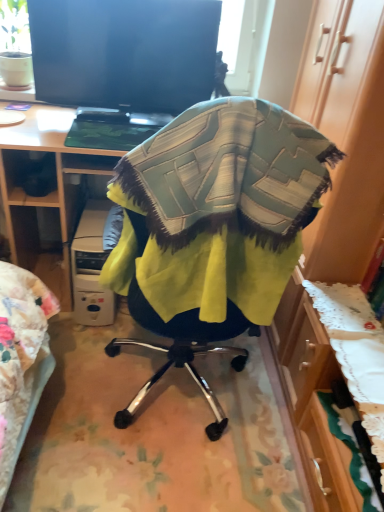
Question: Should I look upward or downward to see textured fabric chair at center?

Choices:
 (A) up
 (B) down

Answer: (A)

Question: Is black glossy screen at upper center positioned in front of textured fabric chair at center?

Choices:
 (A) yes
 (B) no

Answer: (B)

Question: Considering the relative positions of black glossy screen at upper center and textured fabric chair at center in the image provided, is black glossy screen at upper center behind textured fabric chair at center?

Choices:
 (A) yes
 (B) no

Answer: (A)

Question: Is black glossy screen at upper center smaller than textured fabric chair at center?

Choices:
 (A) yes
 (B) no

Answer: (A)

Question: Considering the relative positions of black glossy screen at upper center and textured fabric chair at center in the image provided, is black glossy screen at upper center to the right of textured fabric chair at center from the viewer's perspective?

Choices:
 (A) no
 (B) yes

Answer: (A)

Question: Is there a large distance between black glossy screen at upper center and textured fabric chair at center?

Choices:
 (A) yes
 (B) no

Answer: (B)

Question: Is black glossy screen at upper center facing away from textured fabric chair at center?

Choices:
 (A) no
 (B) yes

Answer: (A)

Question: Is white plastic computer at lower left taller than black glossy screen at upper center?

Choices:
 (A) no
 (B) yes

Answer: (A)

Question: Is the position of white plastic computer at lower left more distant than that of black glossy screen at upper center?

Choices:
 (A) yes
 (B) no

Answer: (A)

Question: Can you confirm if white plastic computer at lower left is thinner than black glossy screen at upper center?

Choices:
 (A) no
 (B) yes

Answer: (A)

Question: From a real-world perspective, is white plastic computer at lower left under black glossy screen at upper center?

Choices:
 (A) no
 (B) yes

Answer: (B)

Question: Are white plastic computer at lower left and black glossy screen at upper center beside each other?

Choices:
 (A) no
 (B) yes

Answer: (A)

Question: Can you confirm if white plastic computer at lower left is positioned to the right of black glossy screen at upper center?

Choices:
 (A) yes
 (B) no

Answer: (B)

Question: Considering the relative sizes of wooden desk at center and white plastic computer at lower left in the image provided, is wooden desk at center taller than white plastic computer at lower left?

Choices:
 (A) no
 (B) yes

Answer: (B)